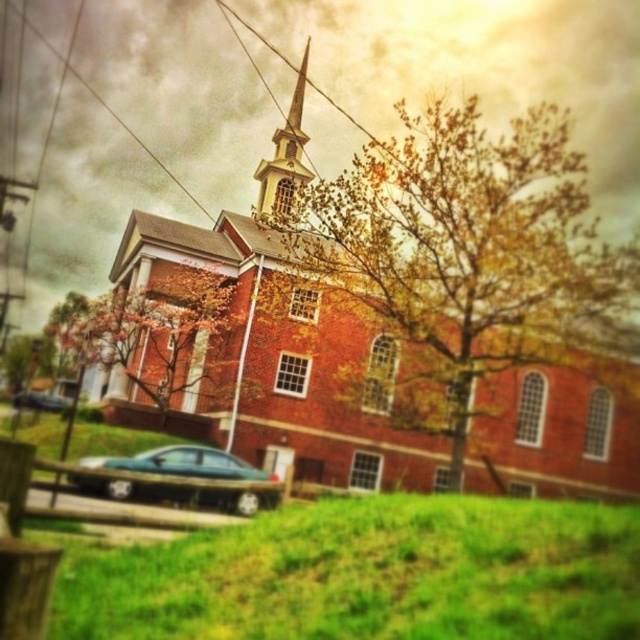
Does point (154, 353) come closer to viewer compared to point (202, 445)?

That is False.

Is point (106, 307) behind point (237, 509)?

Yes, it is.

Does point (168, 285) come in front of point (192, 449)?

No, it is behind (192, 449).

Image resolution: width=640 pixels, height=640 pixels. In order to click on autumn leaves at center in this screenshot , I will do `click(157, 332)`.

Between green grassy field at lower center and metallic blue sedan at lower left, which one has more height?

With more height is green grassy field at lower center.

Is green grassy field at lower center smaller than metallic blue sedan at lower left?

Incorrect, green grassy field at lower center is not smaller in size than metallic blue sedan at lower left.

Between point (372, 561) and point (61, 404), which one is positioned in front?

Positioned in front is point (372, 561).

The image size is (640, 640). In order to click on green grassy field at lower center in this screenshot , I will do `click(369, 573)`.

Who is lower down, metallic teal sedan at lower center or brown textured tree at lower left?

metallic teal sedan at lower center is below.

This screenshot has width=640, height=640. Describe the element at coordinates (182, 464) in the screenshot. I see `metallic teal sedan at lower center` at that location.

This screenshot has height=640, width=640. Find the location of `metallic teal sedan at lower center`. metallic teal sedan at lower center is located at coordinates (182, 464).